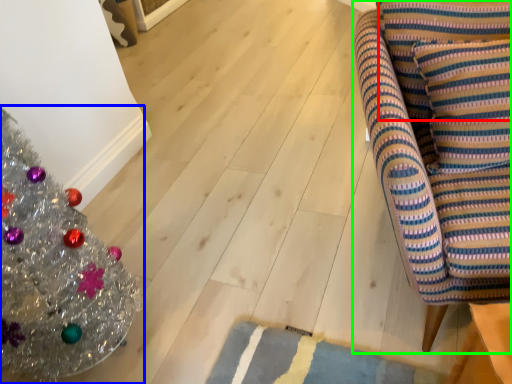
Question: Estimate the real-world distances between objects in this image. Which object is farther from pillow (highlighted by a red box), christmas tree (highlighted by a blue box) or furniture (highlighted by a green box)?

Choices:
 (A) christmas tree
 (B) furniture

Answer: (A)